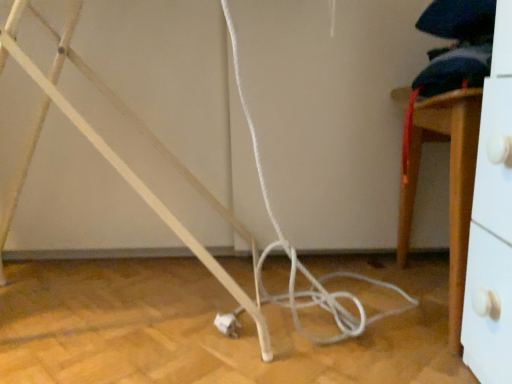
The height and width of the screenshot is (384, 512). What are the coordinates of `white glossy drawer at right` in the screenshot? It's located at (449, 185).

What do you see at coordinates (449, 185) in the screenshot? The image size is (512, 384). I see `white glossy drawer at right` at bounding box center [449, 185].

Locate an element on the screen. white glossy drawer at right is located at coordinates (449, 185).